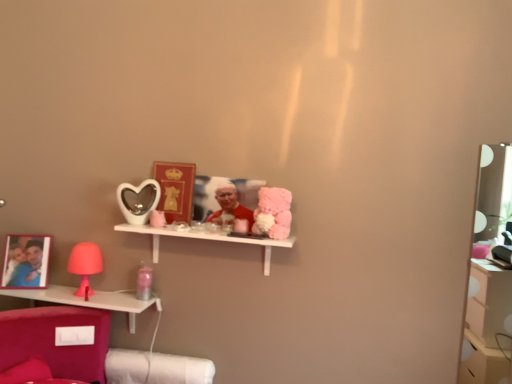
Question: From a real-world perspective, relative to matte pink lamp at left, is smooth red fabric at center vertically above or below?

Choices:
 (A) above
 (B) below

Answer: (A)

Question: Would you say smooth red fabric at center is inside or outside matte pink lamp at left?

Choices:
 (A) inside
 (B) outside

Answer: (B)

Question: Based on their relative distances, which object is nearer to the smooth red fabric at center?

Choices:
 (A) matte pink lamp at left
 (B) matte gold picture frame at center
 (C) fluffy pink plush at center
 (D) matte white heart-shaped mirror at center
 (E) white glossy shelf at center, which is the 1th shelf in right-to-left order

Answer: (C)

Question: Estimate the real-world distances between objects in this image. Which object is closer to the matte white heart-shaped mirror at center?

Choices:
 (A) smooth red fabric at center
 (B) fluffy pink plush at center
 (C) matte pink lamp at left
 (D) matte gold picture frame at center
 (E) pink plastic lamp at lower left, which is counted as the 2th shelf, starting from the right

Answer: (D)